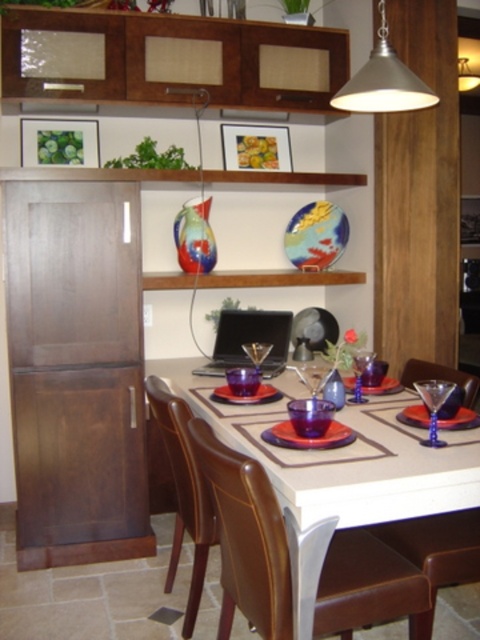
You are a guest at this dining table. You want to reach the transparent blue wine glass at table center to take a sip. However, there is a brown leather chair at lower right in the way. Can you move around the chair to access the wine glass?

The brown leather chair at lower right is to the right of the transparent blue wine glass at table center, so you can move around the chair to the left side to access the glass.

You are standing in the dining area and want to sit down. Which object at point (183, 492) is available for you to sit on?

The brown leather chair at center is located at point (183, 492), so you can sit on it.

You are a server carrying a tray of drinks and need to place a drink on the transparent blue wine glass at table center without bumping into the brown leather chair at lower right. Can you safely do this if the tray is 12 inches wide?

The distance between the brown leather chair at lower right and the transparent blue wine glass at table center is 24.97 inches. Since the tray is 12 inches wide, there is sufficient space to maneuver and place the drink without collision.